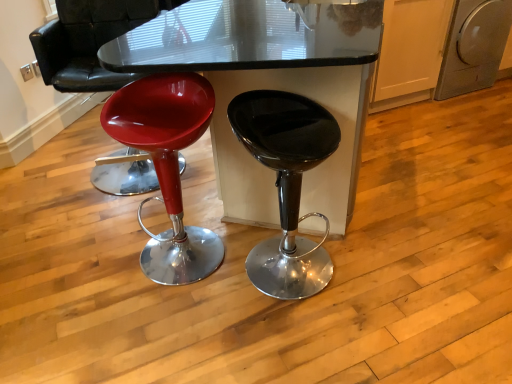
Question: Is glossy plastic stool at left, which is the 2th stool in right-to-left order, bigger than silver metallic dishwasher at right?

Choices:
 (A) no
 (B) yes

Answer: (A)

Question: Does glossy plastic stool at left, which is the 2th stool in right-to-left order, appear on the left side of silver metallic dishwasher at right?

Choices:
 (A) yes
 (B) no

Answer: (A)

Question: From a real-world perspective, is glossy plastic stool at left, which is the 2th stool in right-to-left order, over silver metallic dishwasher at right?

Choices:
 (A) yes
 (B) no

Answer: (A)

Question: Is glossy plastic stool at left, which is the 2th stool in right-to-left order, shorter than silver metallic dishwasher at right?

Choices:
 (A) yes
 (B) no

Answer: (B)

Question: Is silver metallic dishwasher at right completely or partially inside glossy plastic stool at left, the first stool viewed from the left?

Choices:
 (A) no
 (B) yes

Answer: (A)

Question: From the image's perspective, is silver metallic dishwasher at right above or below glossy glass table at center?

Choices:
 (A) above
 (B) below

Answer: (A)

Question: From a real-world perspective, is silver metallic dishwasher at right positioned above or below glossy glass table at center?

Choices:
 (A) above
 (B) below

Answer: (B)

Question: Looking at their shapes, would you say silver metallic dishwasher at right is wider or thinner than glossy glass table at center?

Choices:
 (A) wide
 (B) thin

Answer: (B)

Question: Is silver metallic dishwasher at right inside or outside of glossy glass table at center?

Choices:
 (A) outside
 (B) inside

Answer: (A)

Question: Do you think glossy plastic stool at left is within glossy black stool at center, arranged as the 2th stool when viewed from the left, or outside of it?

Choices:
 (A) inside
 (B) outside

Answer: (B)

Question: Is point (114, 18) closer or farther from the camera than point (285, 180)?

Choices:
 (A) farther
 (B) closer

Answer: (A)

Question: In the image, is glossy plastic stool at left positioned in front of or behind glossy black stool at center, the first stool positioned from the right?

Choices:
 (A) behind
 (B) front

Answer: (A)

Question: Considering the positions of glossy plastic stool at left and glossy black stool at center, the first stool positioned from the right, in the image, is glossy plastic stool at left wider or thinner than glossy black stool at center, the first stool positioned from the right,?

Choices:
 (A) wide
 (B) thin

Answer: (A)

Question: Does point (221, 258) appear closer or farther from the camera than point (104, 16)?

Choices:
 (A) farther
 (B) closer

Answer: (B)

Question: Visually, is glossy plastic stool at left, the first stool viewed from the left, positioned to the left or to the right of glossy plastic stool at left?

Choices:
 (A) left
 (B) right

Answer: (B)